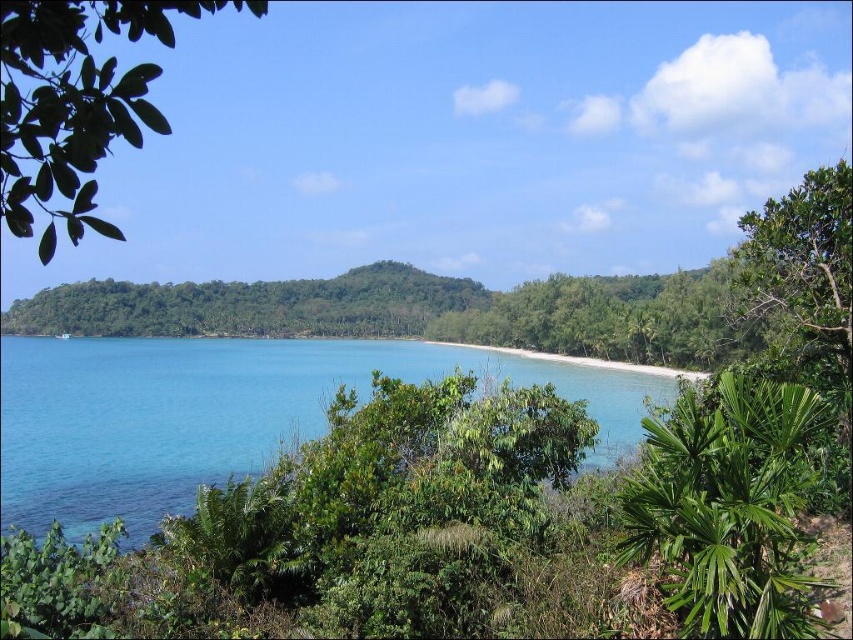
Based on the scene description, where is the green leafy tree at upper left located in the image?

The green leafy tree at upper left is located at point (74, 102) in the image.

You are standing on the beach and want to take a photo of the green leafy tree at center. If your camera has a maximum zoom range of 15 meters, will you be able to capture the tree clearly without moving closer?

The green leafy tree at center is 16.16 meters away from the viewer. Since the camera can only zoom up to 15 meters, you won not be able to capture the tree clearly without moving closer.

You are standing at the point with coordinates (231, 413) in the coastal landscape. What do you see directly in front of you?

At point (231, 413) lies clear blue water at center, so you see clear blue water at center directly in front of you.